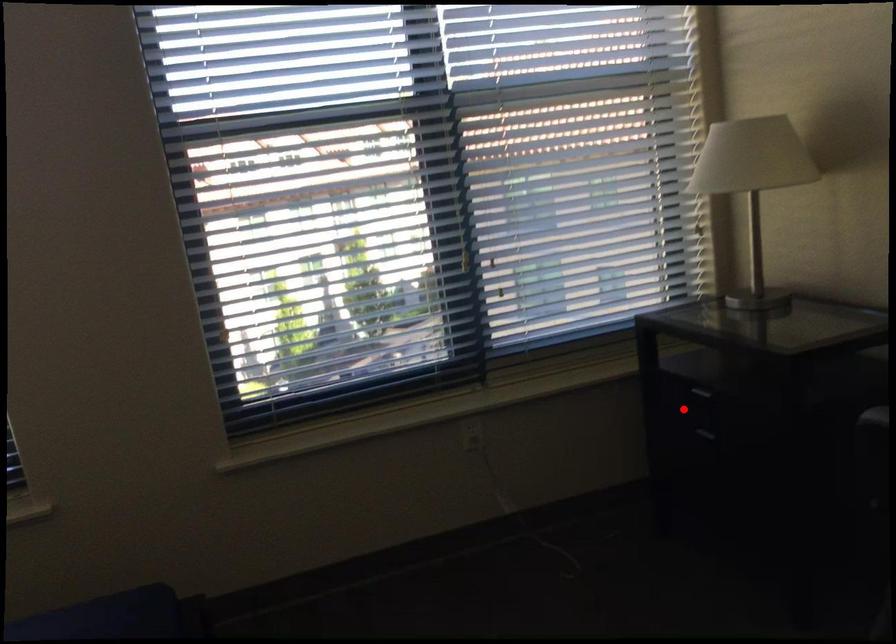
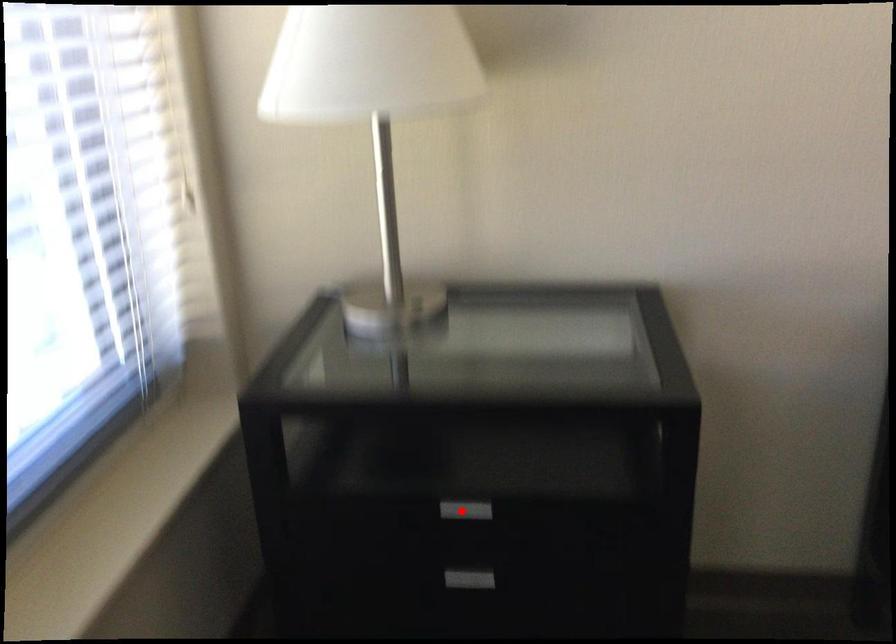
I am providing you with two images of the same scene from different viewpoints. A red point is marked on the first image and another point is marked on the second image. Does the point marked in image1 correspond to the same location as the one in image2?

Yes